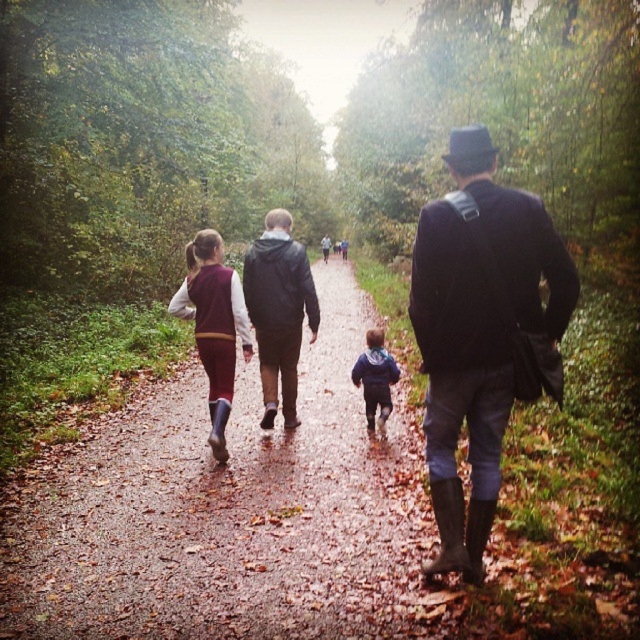
Is brown textured path at center positioned at the back of dark blue wool coat at center?

No.

Who is taller, brown textured path at center or dark blue wool coat at center?

dark blue wool coat at center

Is point (250, 525) positioned after point (506, 340)?

Yes, point (250, 525) is behind point (506, 340).

I want to click on brown textured path at center, so click(x=230, y=515).

Which is in front, point (241, 301) or point (388, 362)?

Point (241, 301) is in front.

What do you see at coordinates (212, 324) in the screenshot?
I see `maroon sweater at center` at bounding box center [212, 324].

Which is behind, point (205, 266) or point (380, 353)?

The point (380, 353) is behind.

I want to click on maroon sweater at center, so click(x=212, y=324).

Looking at this image, can you confirm if brown textured path at center is positioned to the left of dark blue jacket at center?

Correct, you'll find brown textured path at center to the left of dark blue jacket at center.

Identify the location of brown textured path at center. (230, 515).

Is point (33, 518) farther from viewer compared to point (321, 243)?

No, (33, 518) is in front of (321, 243).

Where is `brown textured path at center`? brown textured path at center is located at coordinates (230, 515).